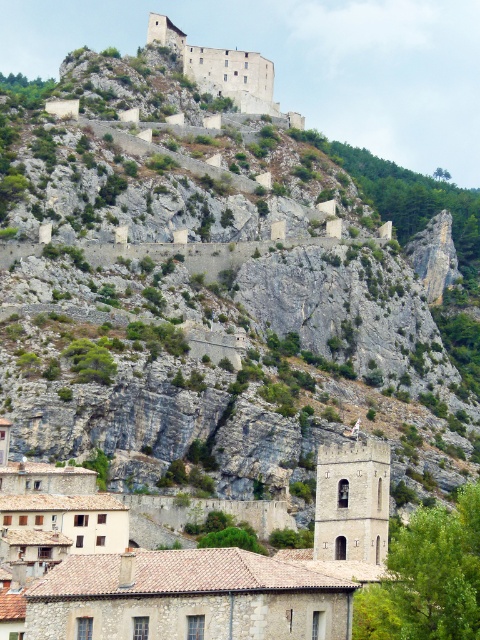
You are a visitor standing at the base of the hill looking up at the stone church at center and the brown stone castle at upper center. Which structure appears larger from your vantage point?

The stone church at center appears larger than the brown stone castle at upper center because it is closer to you and its actual size is bigger.

You are standing at the base of the fortress and want to reach the top. You notice two points marked on your map. Which point, point [278,563] or point [242,68], is closer to you?

Point [278,563] is closer to the viewer than point [242,68].